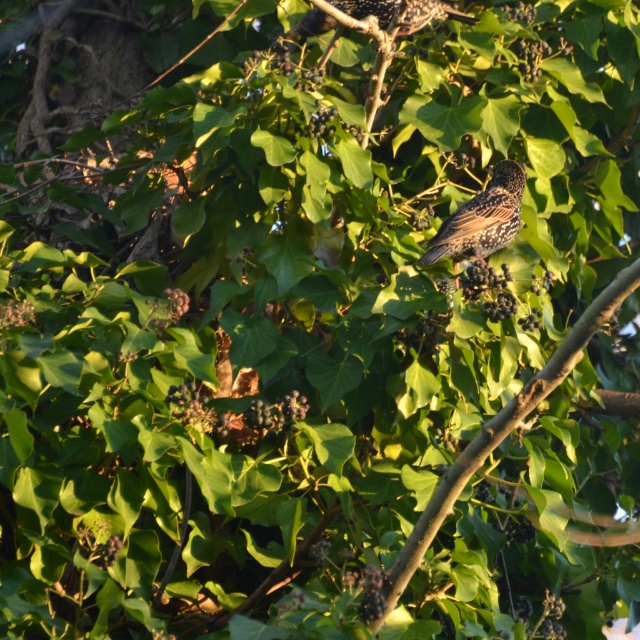
Can you confirm if brown wood tree branch at center is bigger than brown speckled bird at upper center?

Yes.

In the scene shown: Is brown wood tree branch at center in front of brown speckled bird at upper center?

Yes, it is.

The image size is (640, 640). What do you see at coordinates (500, 433) in the screenshot? I see `brown wood tree branch at center` at bounding box center [500, 433].

Find the location of `brown wood tree branch at center`. brown wood tree branch at center is located at coordinates [x=500, y=433].